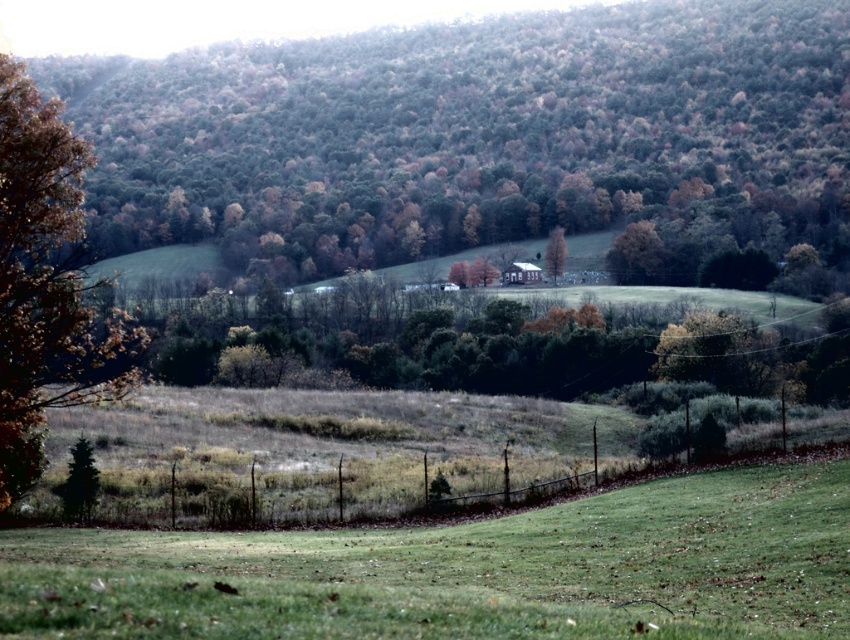
You are standing in the middle of the green grassy field at lower center and want to walk towards the brown matte tree at center. Which direction should you head?

Since the green grassy field at lower center is to the left of brown matte tree at center, you should head to the right to walk towards the brown matte tree at center.

You are standing at the brown textured tree at left and want to walk to the green grassy field at lower center. How far will you have to walk?

The distance between the brown textured tree at left and the green grassy field at lower center is 29.01 feet, so you will have to walk 29.01 feet to reach the green grassy field at lower center.

You are standing in the middle of the grassy field in the foreground of the image. You see a point marked at coordinates (479,138). What object is located at that point?

The point at coordinates (479,138) marks a brown leafy tree at center.